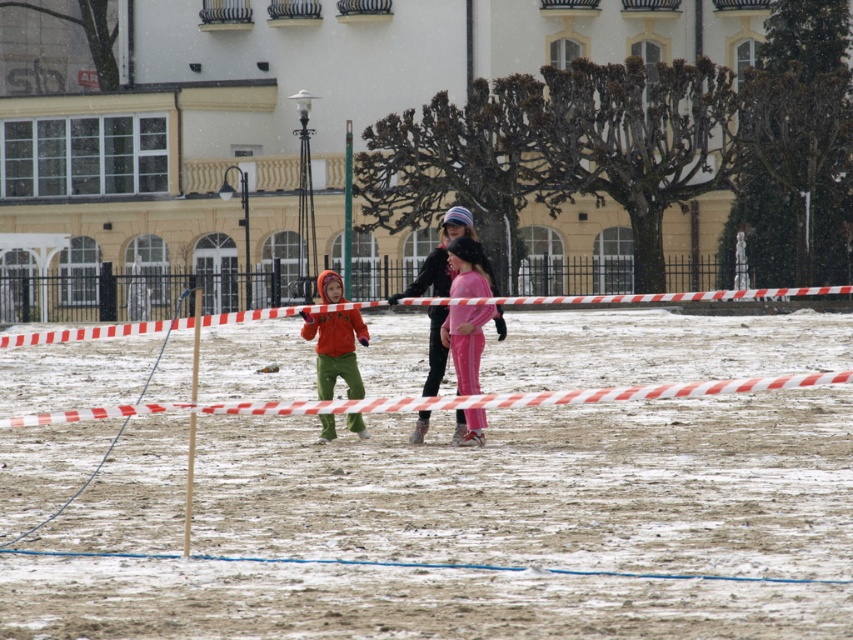
Between point (471, 289) and point (186, 493), which one is positioned in front?

Point (186, 493)

Which of these two, pink fleece pants at center or wooden pole at center, stands taller?

wooden pole at center

Find the location of `pink fleece pants at center`. pink fleece pants at center is located at coordinates (466, 342).

Is matte orange jacket at center thinner than metallic pole at center?

Correct, matte orange jacket at center's width is less than metallic pole at center's.

Who is more distant from viewer, (331, 292) or (349, 256)?

Positioned behind is point (349, 256).

Where is `matte orange jacket at center`? matte orange jacket at center is located at coordinates (335, 349).

Can you confirm if white plastic tape at center is shorter than metallic pole at center?

Indeed, white plastic tape at center has a lesser height compared to metallic pole at center.

Does white plastic tape at center appear on the right side of metallic pole at center?

Yes, white plastic tape at center is to the right of metallic pole at center.

This screenshot has width=853, height=640. Find the location of `white plastic tape at center`. white plastic tape at center is located at coordinates (492, 528).